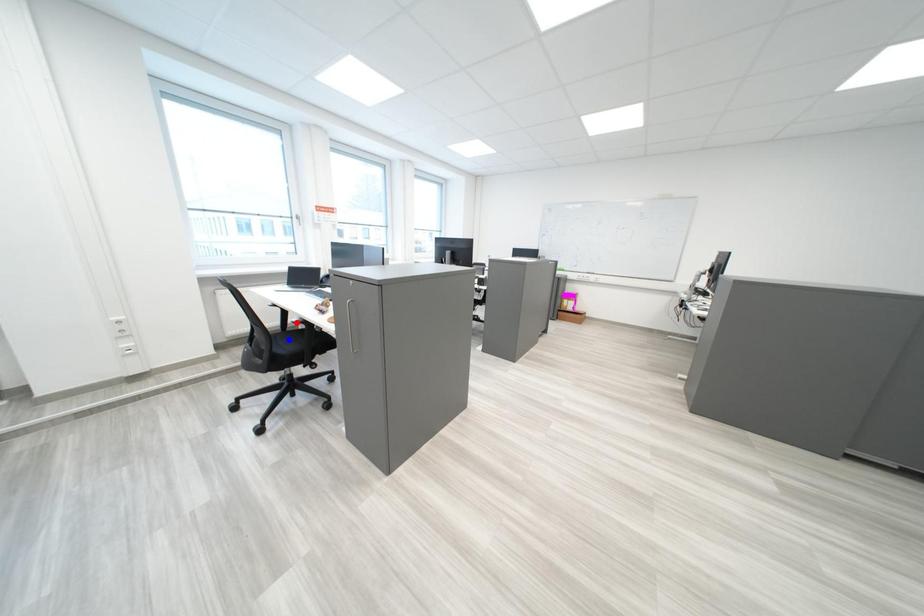
Question: Two points are marked on the image. Which point is closer to the camera?

Choices:
 (A) Blue point is closer.
 (B) Red point is closer.

Answer: (A)